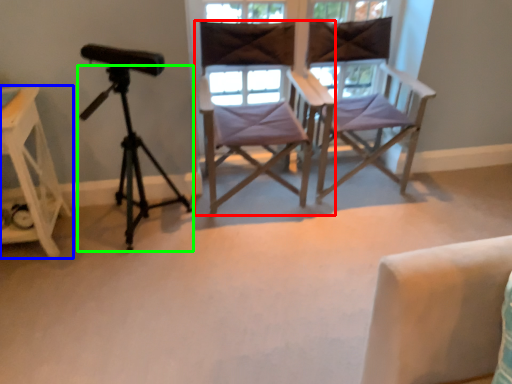
Question: Which object is positioned closest to chair (highlighted by a red box)? Select from furniture (highlighted by a blue box) and tripod (highlighted by a green box).

Choices:
 (A) furniture
 (B) tripod

Answer: (B)